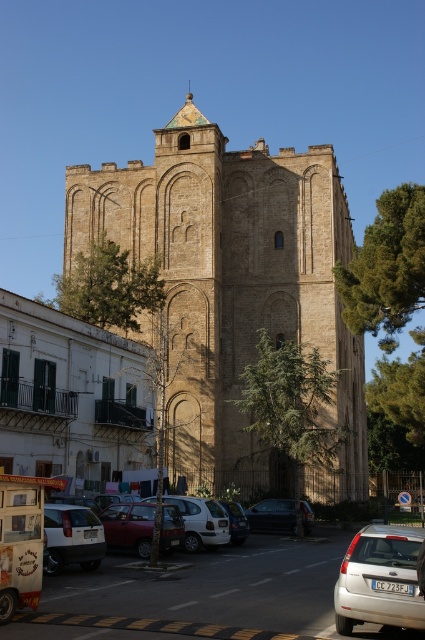
Which is in front, point (110, 545) or point (209, 532)?

Point (110, 545)

Between point (164, 531) and point (198, 520), which one is positioned behind?

Positioned behind is point (198, 520).

The height and width of the screenshot is (640, 425). Identify the location of matte red car at center. (129, 525).

Does white matte car at lower left have a larger size compared to silver metallic car at center?

Actually, white matte car at lower left might be smaller than silver metallic car at center.

Does point (59, 566) come closer to viewer compared to point (238, 506)?

Yes.

You are a GUI agent. You are given a task and a screenshot of the screen. Output one action in this format:
    pyautogui.click(x=<x>, y=<y>)
    Task: Click on the white matte car at lower left
    
    Given the screenshot: What is the action you would take?
    pyautogui.click(x=73, y=536)

At what (x,y) coordinates should I click in order to perform the action: click on matte red car at center. Please return your answer as a coordinate pair (x, y). Image resolution: width=425 pixels, height=640 pixels. Looking at the image, I should click on (129, 525).

Does matte red car at center appear under silver metallic car at center?

Actually, matte red car at center is above silver metallic car at center.

Between point (127, 515) and point (240, 508), which one is positioned behind?

The point (240, 508) is behind.

Identify the location of matte red car at center. Image resolution: width=425 pixels, height=640 pixels. (129, 525).